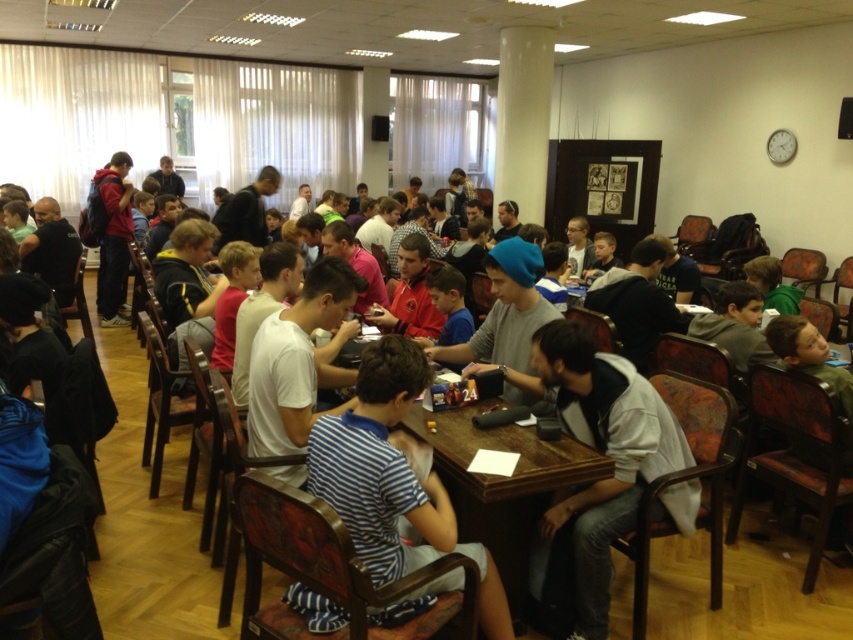
Question: Is white fleece jacket at center below wooden table at center?

Choices:
 (A) yes
 (B) no

Answer: (B)

Question: Can you confirm if white fleece jacket at center is bigger than wooden table at center?

Choices:
 (A) yes
 (B) no

Answer: (B)

Question: Is white fleece jacket at center wider than wooden table at center?

Choices:
 (A) no
 (B) yes

Answer: (A)